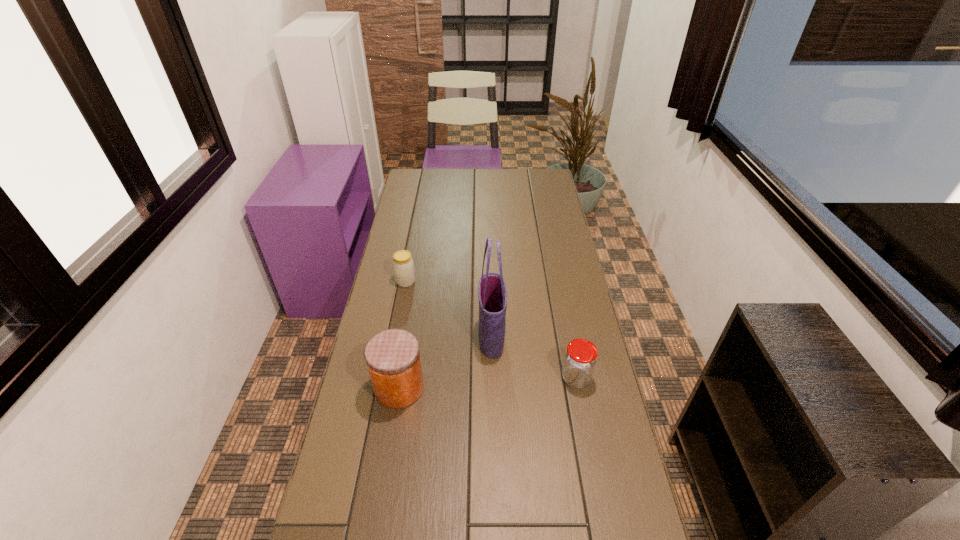
Where is `vacant space at the far edge of the desktop`? This screenshot has height=540, width=960. vacant space at the far edge of the desktop is located at coordinates (500, 173).

Find the location of a particular element. free space at the left edge is located at coordinates (357, 442).

In the image, there is a desktop. Identify the location of free region at the right edge. The image size is (960, 540). (562, 207).

In the image, there is a desktop. Identify the location of free region at the far right corner. (558, 190).

This screenshot has width=960, height=540. Find the location of `vacant area that lies between the rightmost jar and the second farthest object`. vacant area that lies between the rightmost jar and the second farthest object is located at coordinates (534, 357).

You are a GUI agent. You are given a task and a screenshot of the screen. Output one action in this format:
    pyautogui.click(x=<x>, y=<y>)
    Task: Click on the vacant area that lies between the tallest jar and the rightmost jar
    This screenshot has height=540, width=960.
    Given the screenshot: What is the action you would take?
    pyautogui.click(x=488, y=383)

You are a GUI agent. You are given a task and a screenshot of the screen. Output one action in this format:
    pyautogui.click(x=<x>, y=<y>)
    Task: Click on the empty location between the third shortest object and the tote bag
    This screenshot has height=540, width=960.
    Given the screenshot: What is the action you would take?
    pyautogui.click(x=445, y=362)

The width and height of the screenshot is (960, 540). Identify the location of free space between the tallest jar and the tote bag. (445, 362).

Where is `free space between the rightmost object and the tallest jar`? The image size is (960, 540). free space between the rightmost object and the tallest jar is located at coordinates (488, 383).

In order to click on object that is the closest to the rightmost object in this screenshot , I will do `click(492, 294)`.